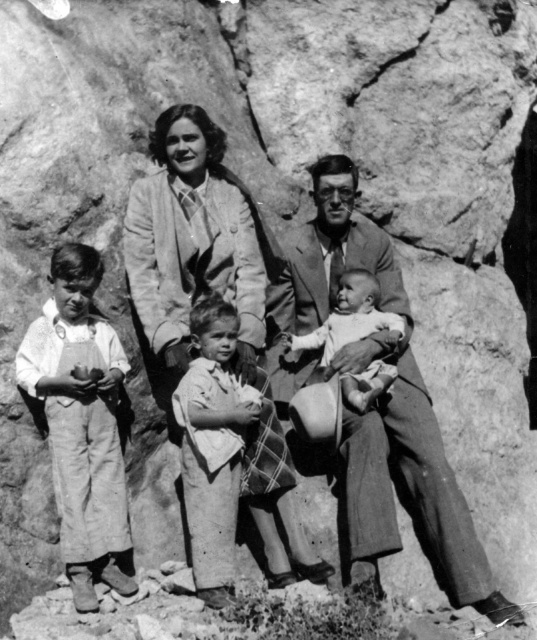
Locate an element on the screen. The height and width of the screenshot is (640, 537). smooth fabric suit at right is located at coordinates (376, 404).

Is smooth fabric suit at right below smooth skin baby at center?

Indeed, smooth fabric suit at right is positioned under smooth skin baby at center.

Image resolution: width=537 pixels, height=640 pixels. Find the location of `smooth fabric suit at right`. smooth fabric suit at right is located at coordinates (376, 404).

In order to click on smooth fabric suit at right in this screenshot , I will do `click(376, 404)`.

Who is higher up, smooth fabric suit at right or light brown cotton dress at center?

smooth fabric suit at right is higher up.

Does smooth fabric suit at right lie in front of light brown cotton dress at center?

Yes.

The height and width of the screenshot is (640, 537). Describe the element at coordinates (376, 404) in the screenshot. I see `smooth fabric suit at right` at that location.

Identify the location of smooth fabric suit at right. (376, 404).

Who is more forward, (156, 154) or (246, 387)?

Point (246, 387) is in front.

Find the location of `matte fabric coat at center`. matte fabric coat at center is located at coordinates (190, 250).